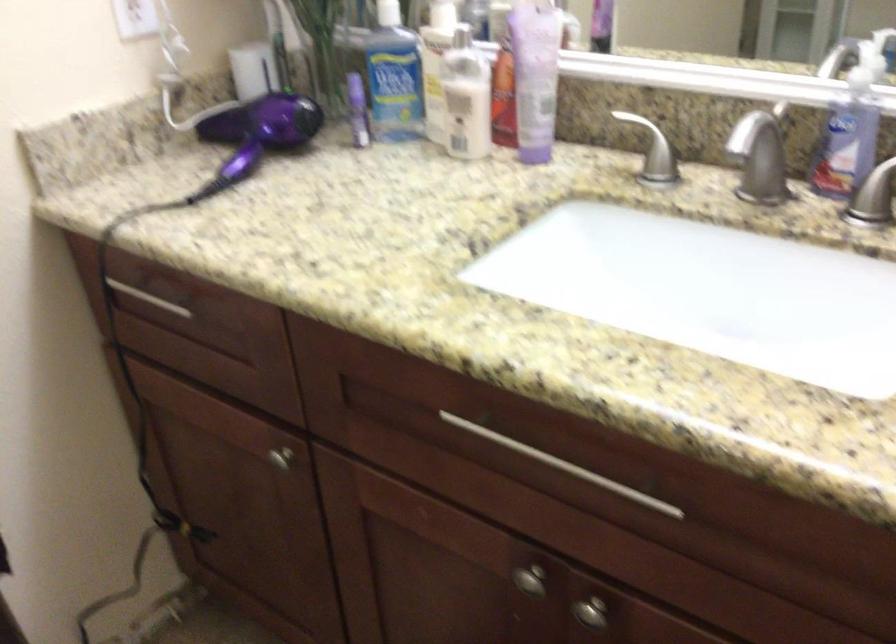
The image size is (896, 644). Describe the element at coordinates (466, 98) in the screenshot. I see `a lotion pump dispenser` at that location.